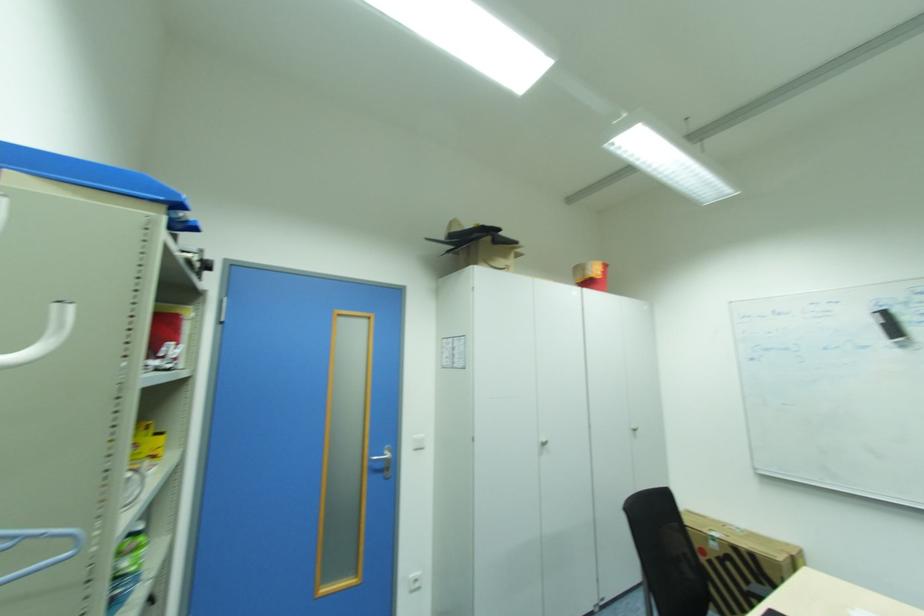
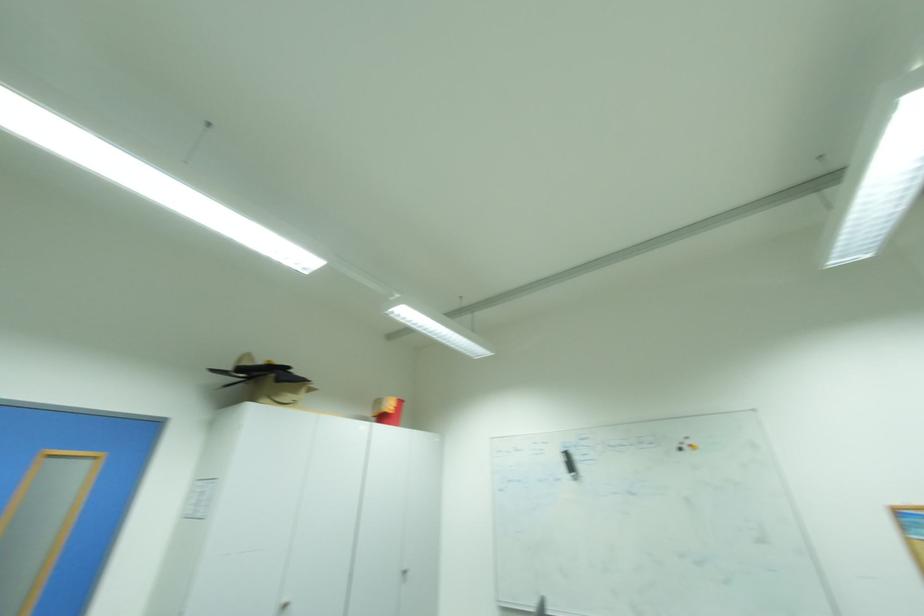
In a continuous first-person perspective shot, in which direction is the camera moving?

The movement direction of the cameraman is right, backward.